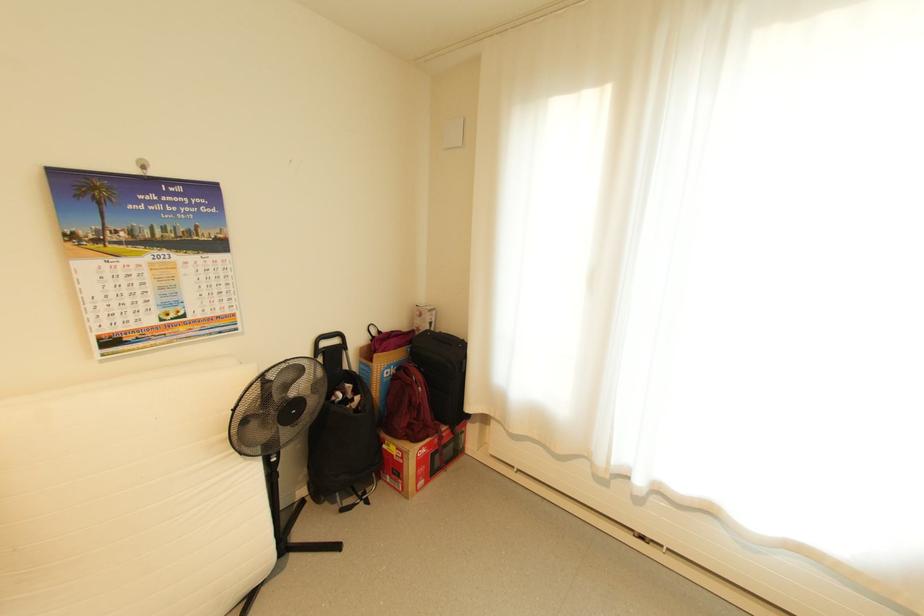
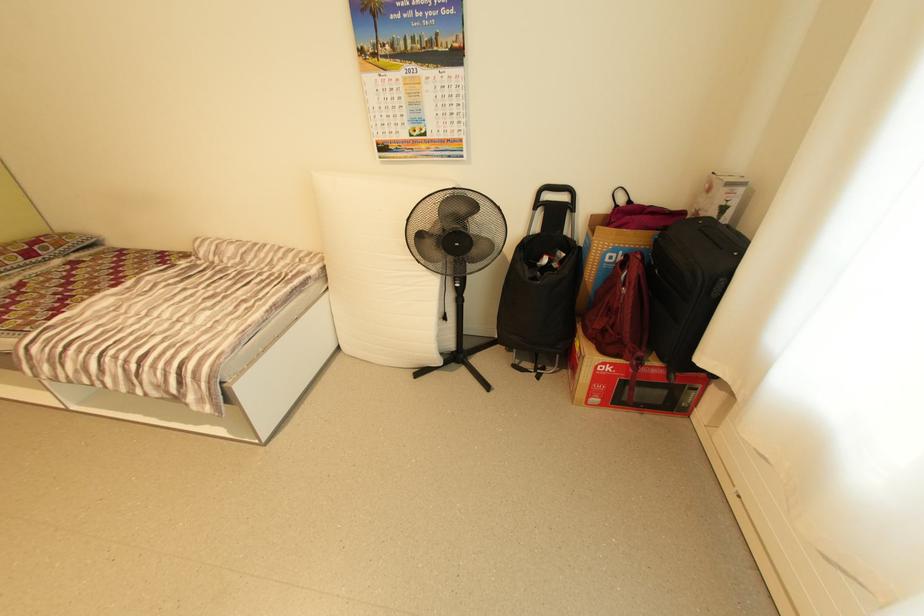
In the second image, find the point that corresponds to (x=404, y=448) in the first image.

(586, 347)